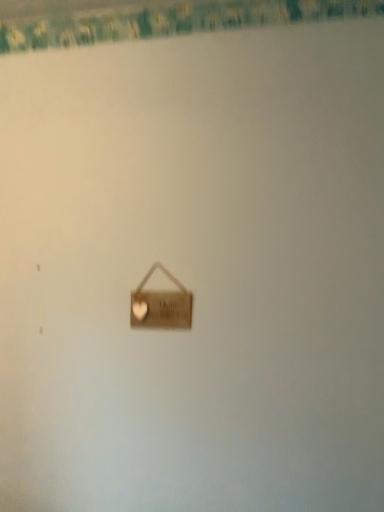
You are a GUI agent. You are given a task and a screenshot of the screen. Output one action in this format:
    pyautogui.click(x=<x>, y=<y>)
    Task: Click on the wooden sign at center
    
    Given the screenshot: What is the action you would take?
    pyautogui.click(x=161, y=305)

What do you see at coordinates (161, 305) in the screenshot?
I see `wooden sign at center` at bounding box center [161, 305].

In order to face green floral fabric at upper center, should I rotate leftwards or rightwards?

To align with it, rotate left about 1.577°.

The width and height of the screenshot is (384, 512). What do you see at coordinates (153, 18) in the screenshot? I see `green floral fabric at upper center` at bounding box center [153, 18].

Where is `green floral fabric at upper center`? green floral fabric at upper center is located at coordinates (153, 18).

At what (x,y) coordinates should I click in order to perform the action: click on wooden sign at center. Please return your answer as a coordinate pair (x, y). Image resolution: width=384 pixels, height=512 pixels. Looking at the image, I should click on (161, 305).

Can you confirm if green floral fabric at upper center is positioned to the left of wooden sign at center?

Incorrect, green floral fabric at upper center is not on the left side of wooden sign at center.

Based on the photo, is green floral fabric at upper center in front of wooden sign at center?

Yes, green floral fabric at upper center is closer to the viewer.

Which point is more distant from viewer, (256, 7) or (152, 327)?

Point (256, 7)

From the image's perspective, is green floral fabric at upper center below wooden sign at center?

No.

From a real-world perspective, which is physically above, green floral fabric at upper center or wooden sign at center?

green floral fabric at upper center, from a real-world perspective.

Which object is wider, green floral fabric at upper center or wooden sign at center?

green floral fabric at upper center is wider.

Considering the sizes of objects green floral fabric at upper center and wooden sign at center in the image provided, who is shorter, green floral fabric at upper center or wooden sign at center?

green floral fabric at upper center.

Considering the sizes of green floral fabric at upper center and wooden sign at center in the image, is green floral fabric at upper center bigger or smaller than wooden sign at center?

green floral fabric at upper center is bigger than wooden sign at center.

Can we say green floral fabric at upper center lies outside wooden sign at center?

Indeed, green floral fabric at upper center is completely outside wooden sign at center.

Would you say green floral fabric at upper center is a long distance from wooden sign at center?

green floral fabric at upper center is actually quite close to wooden sign at center.

Is green floral fabric at upper center positioned with its back to wooden sign at center?

That's not correct — green floral fabric at upper center is not looking away from wooden sign at center.

Identify the location of curtain in front of the wooden sign at center. [x=153, y=18].

Between wooden sign at center and green floral fabric at upper center, which one appears on the right side from the viewer's perspective?

Positioned to the right is green floral fabric at upper center.

Based on the photo, is wooden sign at center in front of or behind green floral fabric at upper center in the image?

wooden sign at center is behind green floral fabric at upper center.

Is point (182, 317) positioned before point (160, 34)?

Yes, it is in front of point (160, 34).

From the image's perspective, which is above, wooden sign at center or green floral fabric at upper center?

From the image's view, green floral fabric at upper center is above.

From a real-world perspective, which object rests below the other?

wooden sign at center.

In terms of width, does wooden sign at center look wider or thinner when compared to green floral fabric at upper center?

In the image, wooden sign at center appears to be more narrow than green floral fabric at upper center.

Can you confirm if wooden sign at center is shorter than green floral fabric at upper center?

In fact, wooden sign at center may be taller than green floral fabric at upper center.

In terms of size, does wooden sign at center appear bigger or smaller than green floral fabric at upper center?

In the image, wooden sign at center appears to be smaller than green floral fabric at upper center.

Is wooden sign at center positioned beyond the bounds of green floral fabric at upper center?

Yes.

Is wooden sign at center not close to green floral fabric at upper center?

No, wooden sign at center is not far from green floral fabric at upper center.

From the picture: Could you tell me if wooden sign at center is turned towards green floral fabric at upper center?

No, wooden sign at center is not facing towards green floral fabric at upper center.

How different are the orientations of wooden sign at center and green floral fabric at upper center in degrees?

The angular difference between wooden sign at center and green floral fabric at upper center is 89.9 degrees.

Measure the distance between wooden sign at center and green floral fabric at upper center.

wooden sign at center and green floral fabric at upper center are 33.70 inches apart.

You are a GUI agent. You are given a task and a screenshot of the screen. Output one action in this format:
    pyautogui.click(x=<x>, y=<y>)
    Task: Click on the curtain lying above the wooden sign at center (from the image's perspective)
    
    Given the screenshot: What is the action you would take?
    pyautogui.click(x=153, y=18)

The height and width of the screenshot is (512, 384). I want to click on handbag below the green floral fabric at upper center (from a real-world perspective), so click(x=161, y=305).

Where is `curtain that is on the right side of wooden sign at center`? This screenshot has width=384, height=512. curtain that is on the right side of wooden sign at center is located at coordinates (153, 18).